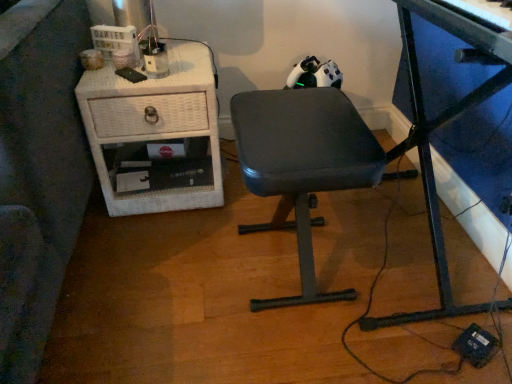
This screenshot has width=512, height=384. What do you see at coordinates (302, 165) in the screenshot? I see `dark gray fabric chair at center` at bounding box center [302, 165].

The image size is (512, 384). In order to click on dark gray fabric chair at center in this screenshot , I will do `click(302, 165)`.

What is the approximate width of metallic blue desk at center?

The width of metallic blue desk at center is 16.93 inches.

This screenshot has width=512, height=384. What are the coordinates of `white wicker nightstand at left` in the screenshot? It's located at (155, 134).

Which of these two, white wicker nightstand at left or dark gray fabric chair at center, stands taller?

Standing taller between the two is dark gray fabric chair at center.

Is white wicker nightstand at left turned away from dark gray fabric chair at center?

No, white wicker nightstand at left is not facing the opposite direction of dark gray fabric chair at center.

Considering the relative sizes of white wicker nightstand at left and dark gray fabric chair at center in the image provided, is white wicker nightstand at left bigger than dark gray fabric chair at center?

Yes, white wicker nightstand at left is bigger than dark gray fabric chair at center.

Looking at this image, is dark gray fabric chair at center located within white wicker nightstand at left?

That's incorrect, dark gray fabric chair at center is not inside white wicker nightstand at left.

In the scene shown: From the image's perspective, would you say metallic blue desk at center is shown under white wicker nightstand at left?

Yes, from the image's perspective, metallic blue desk at center is below white wicker nightstand at left.

Is metallic blue desk at center wider or thinner than white wicker nightstand at left?

metallic blue desk at center is thinner than white wicker nightstand at left.

Based on their positions, is metallic blue desk at center located to the left or right of white wicker nightstand at left?

metallic blue desk at center is positioned on white wicker nightstand at left's right side.

Considering the positions of objects metallic blue desk at center and white wicker nightstand at left in the image provided, who is behind, metallic blue desk at center or white wicker nightstand at left?

white wicker nightstand at left is behind.

In terms of height, does dark gray fabric chair at center look taller or shorter compared to metallic blue desk at center?

In the image, dark gray fabric chair at center appears to be shorter than metallic blue desk at center.

Considering the sizes of objects dark gray fabric chair at center and metallic blue desk at center in the image provided, who is smaller, dark gray fabric chair at center or metallic blue desk at center?

With smaller size is dark gray fabric chair at center.

What's the angular difference between dark gray fabric chair at center and metallic blue desk at center's facing directions?

5.27 degrees separate the facing orientations of dark gray fabric chair at center and metallic blue desk at center.

Between dark gray fabric chair at center and metallic blue desk at center, which one appears on the right side from the viewer's perspective?

Positioned to the right is metallic blue desk at center.

Could dark gray fabric chair at center be considered to be inside metallic blue desk at center?

No, dark gray fabric chair at center is not inside metallic blue desk at center.

Is metallic blue desk at center in front of or behind dark gray fabric chair at center in the image?

Clearly, metallic blue desk at center is in front of dark gray fabric chair at center.

Is metallic blue desk at center aimed at dark gray fabric chair at center?

Yes, metallic blue desk at center is aimed at dark gray fabric chair at center.

Identify the location of desk in front of the dark gray fabric chair at center. (429, 143).

From a real-world perspective, is dark gray fabric chair at center physically below white wicker nightstand at left?

No, from a real-world perspective, dark gray fabric chair at center is not beneath white wicker nightstand at left.

Is dark gray fabric chair at center facing away from white wicker nightstand at left?

No, white wicker nightstand at left is not at the back of dark gray fabric chair at center.

Can you confirm if dark gray fabric chair at center is taller than white wicker nightstand at left?

Yes, dark gray fabric chair at center is taller than white wicker nightstand at left.

Is point (270, 140) positioned behind point (182, 192)?

No, it is in front of (182, 192).

I want to click on desk that appears below the white wicker nightstand at left (from the image's perspective), so click(429, 143).

Is metallic blue desk at center at the back of white wicker nightstand at left?

No, white wicker nightstand at left is not facing the opposite direction of metallic blue desk at center.

Between white wicker nightstand at left and metallic blue desk at center, which one has less height?

white wicker nightstand at left.

This screenshot has height=384, width=512. Find the location of `chair lying below the white wicker nightstand at left (from the image's perspective)`. chair lying below the white wicker nightstand at left (from the image's perspective) is located at coordinates (302, 165).

Find the location of `nightstand behind the metallic blue desk at center`. nightstand behind the metallic blue desk at center is located at coordinates (155, 134).

From the picture: Looking at the image, which one is located closer to white wicker nightstand at left, dark gray fabric chair at center or metallic blue desk at center?

dark gray fabric chair at center lies closer to white wicker nightstand at left than the other object.

Which object lies further to the anchor point dark gray fabric chair at center, white wicker nightstand at left or metallic blue desk at center?

white wicker nightstand at left.

From the image, which object appears to be farther from dark gray fabric chair at center, metallic blue desk at center or white wicker nightstand at left?

white wicker nightstand at left is positioned further to the anchor dark gray fabric chair at center.

Estimate the real-world distances between objects in this image. Which object is closer to metallic blue desk at center, white wicker nightstand at left or dark gray fabric chair at center?

Based on the image, dark gray fabric chair at center appears to be nearer to metallic blue desk at center.

In the scene shown: Considering their positions, is dark gray fabric chair at center positioned closer to metallic blue desk at center than white wicker nightstand at left?

dark gray fabric chair at center is closer to metallic blue desk at center.

Looking at the image, which one is located closer to white wicker nightstand at left, metallic blue desk at center or dark gray fabric chair at center?

dark gray fabric chair at center is positioned closer to the anchor white wicker nightstand at left.

At what (x,y) coordinates should I click in order to perform the action: click on chair situated between white wicker nightstand at left and metallic blue desk at center from left to right. Please return your answer as a coordinate pair (x, y). Image resolution: width=512 pixels, height=384 pixels. Looking at the image, I should click on (302, 165).